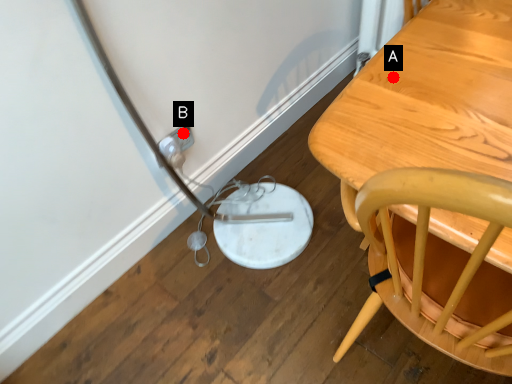
Question: Two points are circled on the image, labeled by A and B beside each circle. Among these points, which one is farthest from the camera?

Choices:
 (A) A is further
 (B) B is further

Answer: (B)